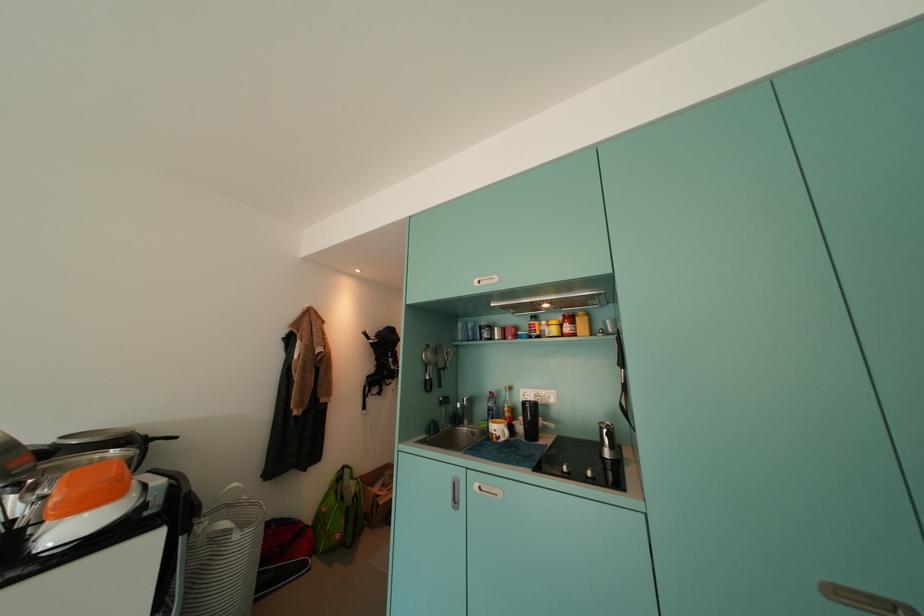
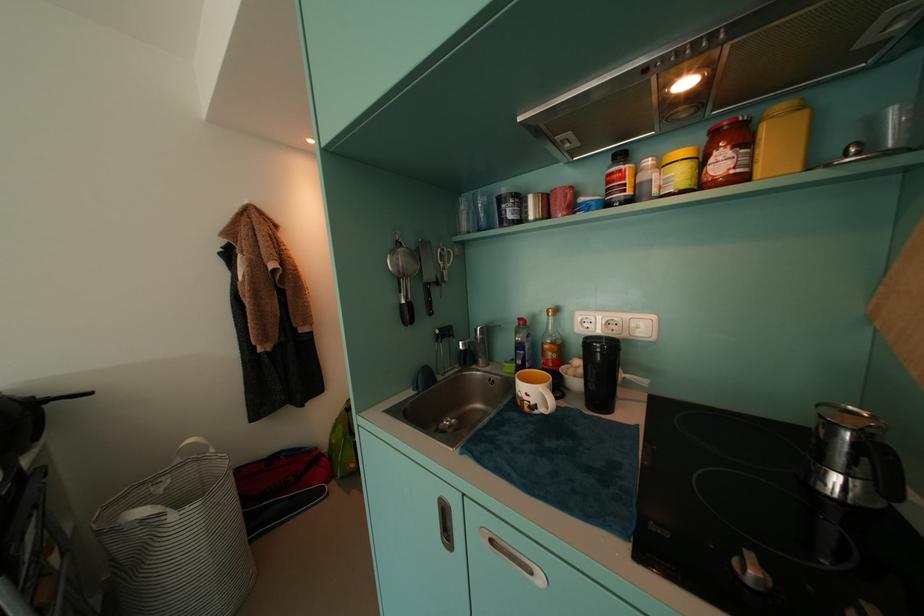
Locate, in the second image, the point that corresponds to pixel 626 467 in the first image.

(891, 525)